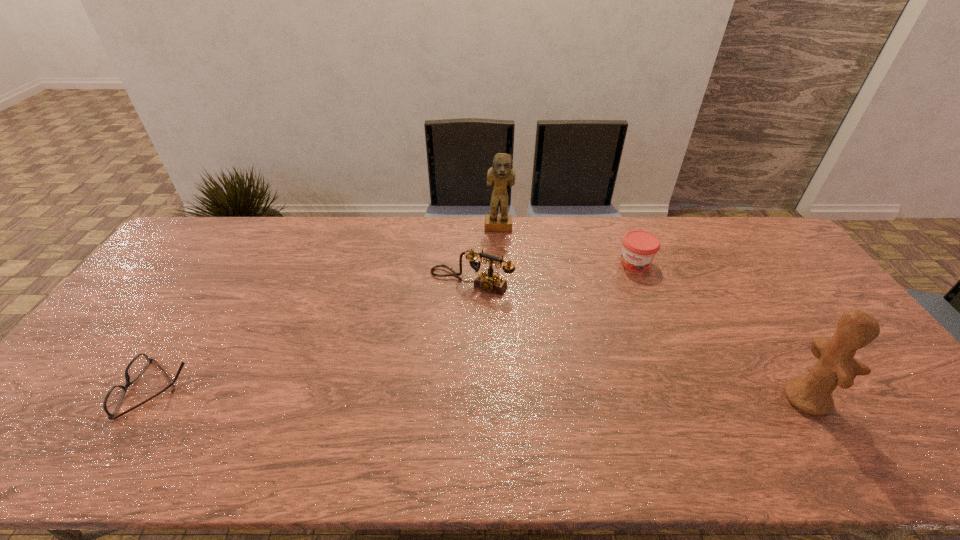
Locate an element on the screen. free space on the desktop that is between the leftmost object and the right figurine and is positioned on the front-facing side of the farther figurine is located at coordinates (510, 394).

Image resolution: width=960 pixels, height=540 pixels. Identify the location of free spot on the desktop that is between the leftmost object and the rightmost object and is positioned on the front label of the second shortest object. (563, 394).

Where is `vacant spot on the desktop that is between the shortest object and the nearer figurine and is positioned on the front-facing side of the telephone`? Image resolution: width=960 pixels, height=540 pixels. vacant spot on the desktop that is between the shortest object and the nearer figurine and is positioned on the front-facing side of the telephone is located at coordinates (394, 392).